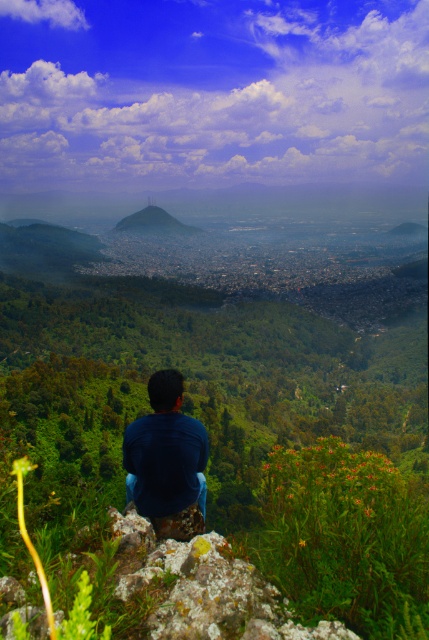
You are standing at the point labeled point (138, 216) and want to take a photo of the person sitting on the rocky outcrop. To ensure the person is in focus, you need to adjust your camera so it points towards the person. Which direction should you move your camera relative to point (172, 428)?

Since point (172, 428) is closer to the camera than point (138, 216), you should move your camera towards point (172, 428) to focus on the person sitting on the rocky outcrop.

You are a photographer trying to capture the entire scene in one shot. Given that the dark blue shirt at center and the green mossy hill at center are both in the center, which object would appear larger in the photo?

The dark blue shirt at center is smaller than the green mossy hill at center, so the green mossy hill at center would appear larger in the photo.

You are a photographer trying to capture the dark blue shirt at center and the green mossy hill at center in the same frame. Based on their positions, which object should you focus on first to ensure both are in focus?

The dark blue shirt at center has a lesser height compared to the green mossy hill at center, so you should focus on the green mossy hill at center first to ensure both are in focus.